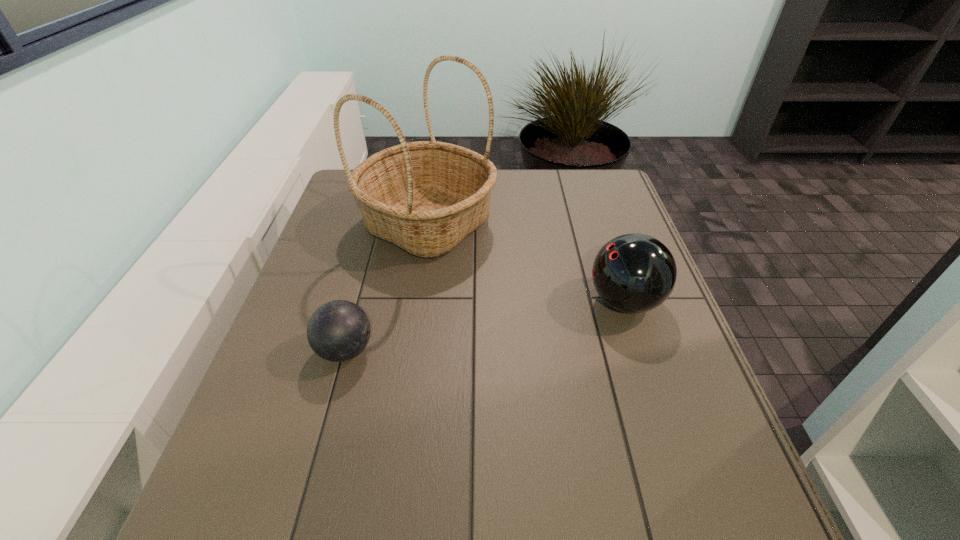
Locate an element on the screen. vacant space in between the shortest object and the basket is located at coordinates (387, 287).

The height and width of the screenshot is (540, 960). In order to click on blank region between the right bowling ball and the left bowling ball in this screenshot , I will do `click(485, 326)`.

At what (x,y) coordinates should I click in order to perform the action: click on free space between the shortest object and the basket. Please return your answer as a coordinate pair (x, y). Looking at the image, I should click on (387, 287).

Locate an element on the screen. This screenshot has height=540, width=960. empty space between the farthest object and the shorter bowling ball is located at coordinates (387, 287).

Where is `empty space between the basket and the taller bowling ball`? empty space between the basket and the taller bowling ball is located at coordinates (526, 262).

Where is `vacant space in between the shortest object and the taller bowling ball`? Image resolution: width=960 pixels, height=540 pixels. vacant space in between the shortest object and the taller bowling ball is located at coordinates (485, 326).

This screenshot has width=960, height=540. I want to click on vacant point located between the farthest object and the shortest object, so click(x=387, y=287).

What are the coordinates of `vacant point located between the farthest object and the shortest object` in the screenshot? It's located at (387, 287).

You are a GUI agent. You are given a task and a screenshot of the screen. Output one action in this format:
    pyautogui.click(x=<x>, y=<y>)
    Task: Click on the vacant space in between the basket and the shorter bowling ball
    The image size is (960, 540).
    Given the screenshot: What is the action you would take?
    pyautogui.click(x=387, y=287)

Image resolution: width=960 pixels, height=540 pixels. Find the location of `vacant space that's between the taller bowling ball and the shorter bowling ball`. vacant space that's between the taller bowling ball and the shorter bowling ball is located at coordinates (485, 326).